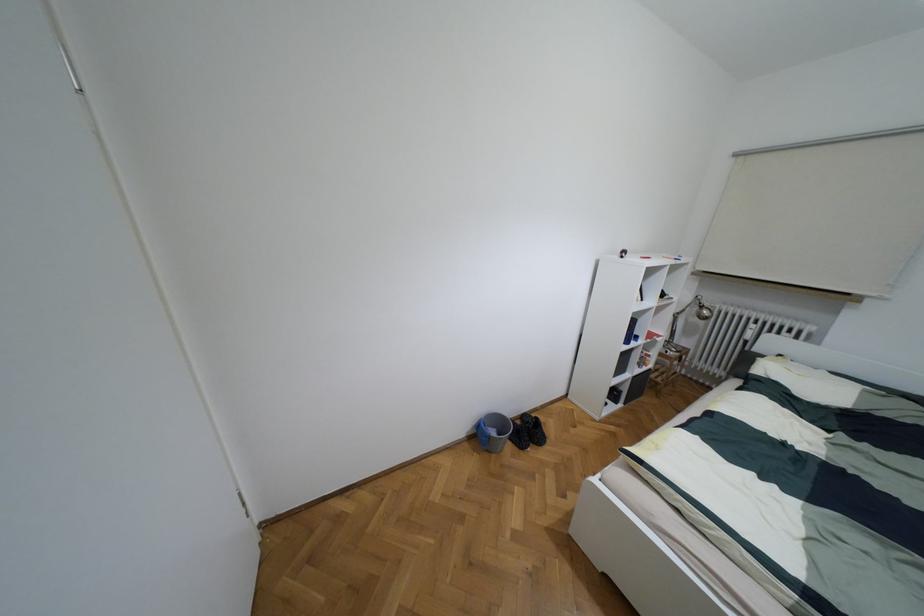
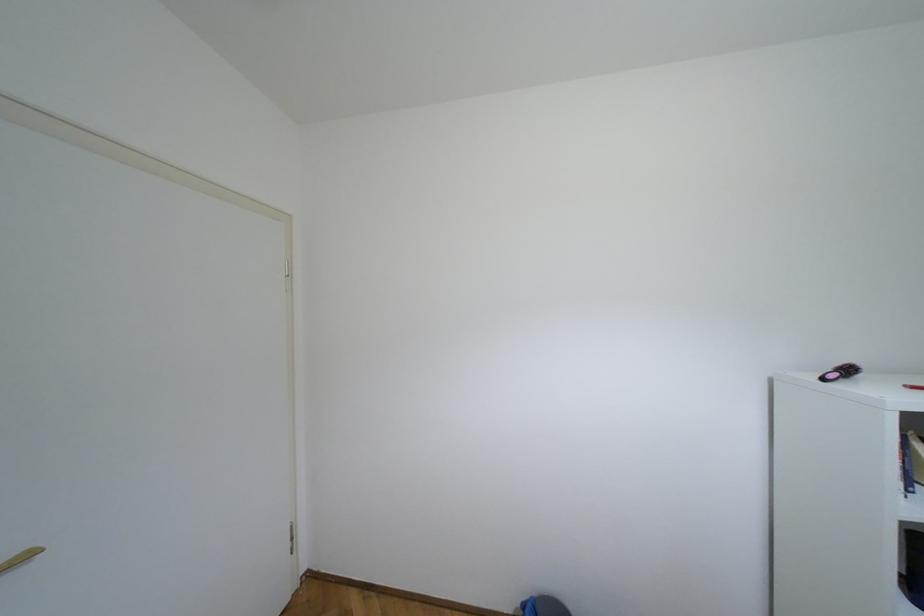
The images are taken continuously from a first-person perspective. In which direction is your viewpoint rotating?

The rotation direction of the camera is left-up.